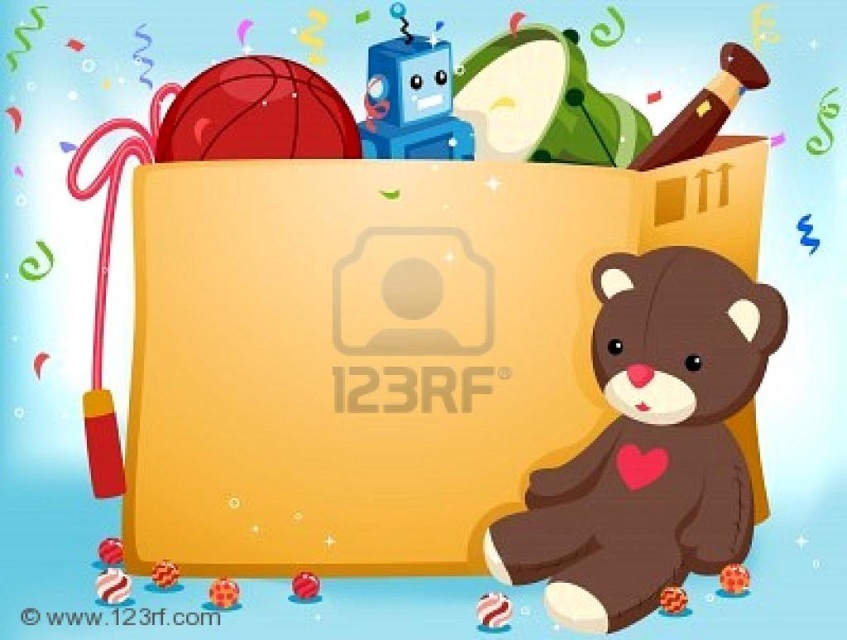
Question: Which of these objects is positioned closest to the green fabric pillow at upper center?

Choices:
 (A) smooth red ball at lower left
 (B) smooth plastic candy cane at lower left

Answer: (A)

Question: In this image, where is smooth plastic candy cane at lower left located relative to polka dot fabric ball at lower left?

Choices:
 (A) below
 (B) above

Answer: (B)

Question: Which object appears closest to the camera in this image?

Choices:
 (A) orange matte ball at lower left
 (B) smooth plastic candy cane at lower left
 (C) blue plastic robot at upper center
 (D) green fabric pillow at upper center

Answer: (B)

Question: Estimate the real-world distances between objects in this image. Which object is farther from the orange matte ball at lower left?

Choices:
 (A) green fabric pillow at upper center
 (B) brown plush bear at lower right
 (C) smooth red ball at center
 (D) smooth orange ball at lower center

Answer: (A)

Question: Is brown plush bear at lower right to the right of smooth plastic candy cane at lower left from the viewer's perspective?

Choices:
 (A) no
 (B) yes

Answer: (B)

Question: Where is blue plastic robot at upper center located in relation to polka dot fabric ball at lower left in the image?

Choices:
 (A) below
 (B) above

Answer: (B)